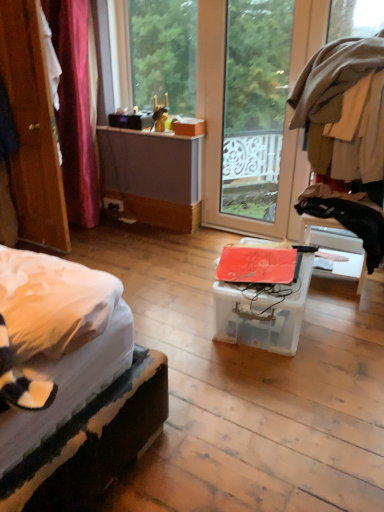
Question: Considering the positions of wooden door at left and transparent plastic box at center in the image, is wooden door at left taller or shorter than transparent plastic box at center?

Choices:
 (A) tall
 (B) short

Answer: (A)

Question: Is point (29, 19) positioned closer to the camera than point (301, 318)?

Choices:
 (A) farther
 (B) closer

Answer: (A)

Question: Which of these objects is positioned farthest from the transparent plastic box at center?

Choices:
 (A) transparent glass window at upper center
 (B) transparent glass door at center
 (C) wooden door at left
 (D) black plastic power outlet at lower left
 (E) black fabric at right

Answer: (B)

Question: Considering the real-world distances, which object is closest to the wooden door at left?

Choices:
 (A) transparent glass window at upper center
 (B) transparent plastic box at center
 (C) black plastic power outlet at lower left
 (D) black fabric at right
 (E) transparent glass door at center

Answer: (C)